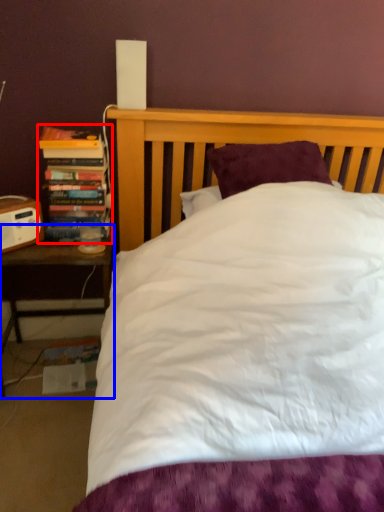
Question: Among these objects, which one is nearest to the camera, book (highlighted by a red box) or nightstand (highlighted by a blue box)?

Choices:
 (A) book
 (B) nightstand

Answer: (B)